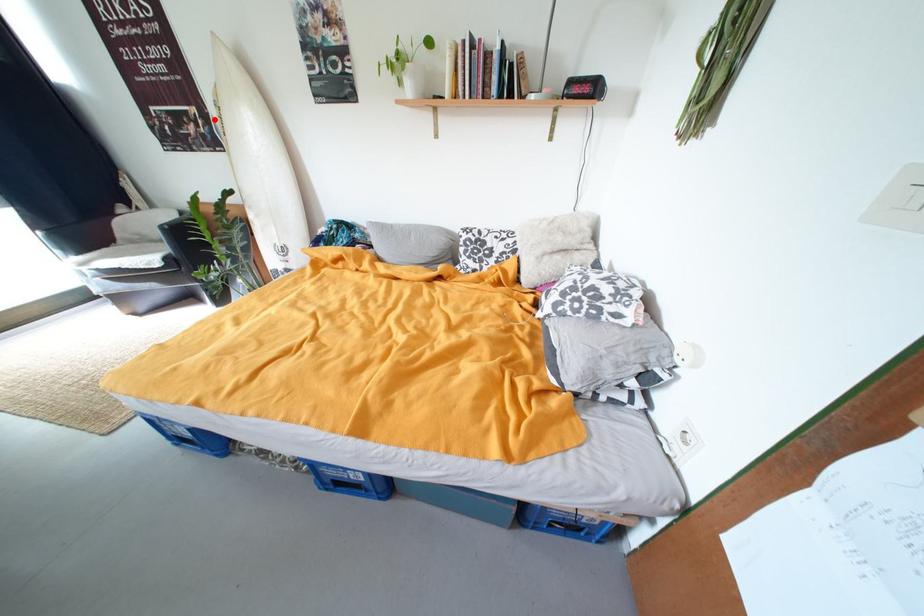
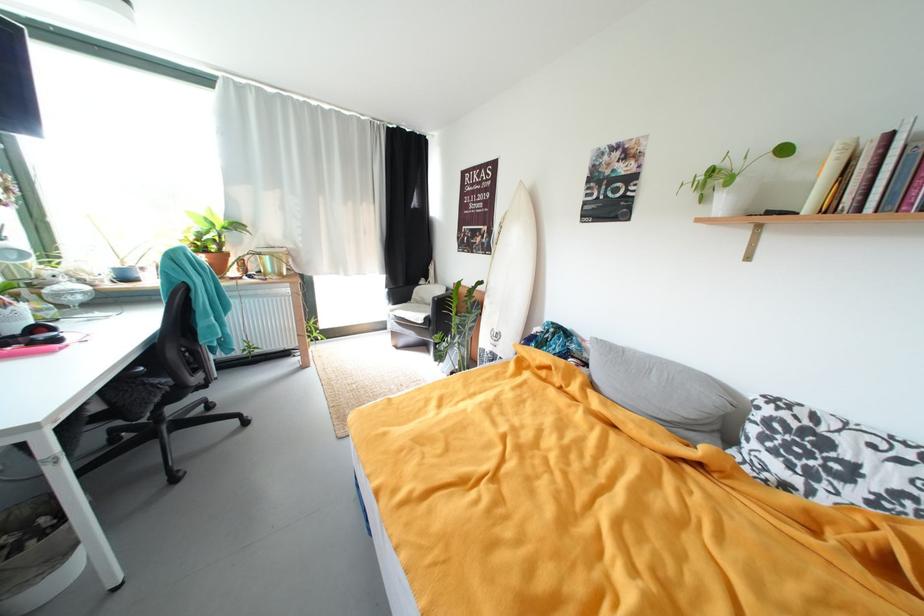
Question: A red point is marked in image1. In image2, is the corresponding 3D point closer to the camera or farther? Reply with the corresponding letter.

Choices:
 (A) The corresponding 3D point is closer.
 (B) The corresponding 3D point is farther.

Answer: (A)